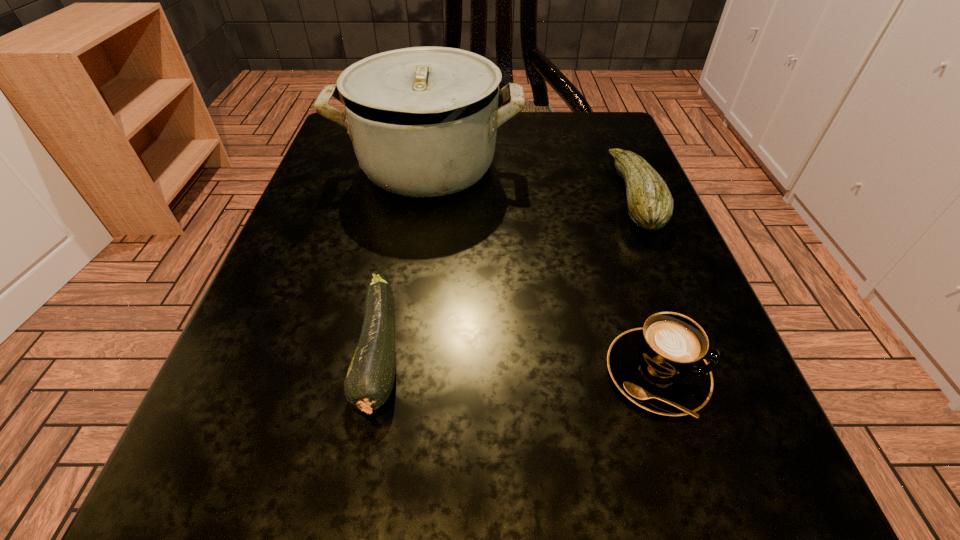
This screenshot has height=540, width=960. Find the location of `free spot between the cappuccino and the right zucchini`. free spot between the cappuccino and the right zucchini is located at coordinates (645, 284).

Identify the location of vacant area that lies between the left zucchini and the right zucchini. (507, 275).

The image size is (960, 540). Identify the location of free space that is in between the cappuccino and the tallest object. (542, 271).

Locate which object is the closest to the shorter zucchini. Please provide its 2D coordinates. Your answer should be formatted as a tuple, i.e. [(x, y)], where the tuple contains the x and y coordinates of a point satisfying the conditions above.

[(423, 121)]

Locate an element on the screen. Image resolution: width=960 pixels, height=540 pixels. the third closest object to the saucepan is located at coordinates (661, 367).

The image size is (960, 540). Find the location of `free spot that satisfies the following two spatial constraints: 1. at the stem end of the taller zucchini; 2. at the blossom end of the left zucchini`. free spot that satisfies the following two spatial constraints: 1. at the stem end of the taller zucchini; 2. at the blossom end of the left zucchini is located at coordinates (700, 355).

At what (x,y) coordinates should I click in order to perform the action: click on vacant area that satisfies the following two spatial constraints: 1. at the stem end of the right zucchini; 2. at the blossom end of the left zucchini. Please return your answer as a coordinate pair (x, y). Looking at the image, I should click on (700, 355).

I want to click on free space that satisfies the following two spatial constraints: 1. at the stem end of the taller zucchini; 2. at the blossom end of the left zucchini, so click(x=700, y=355).

Find the location of `vacant point that satisfies the following two spatial constraints: 1. at the stem end of the farther zucchini; 2. at the blossom end of the shorter zucchini`. vacant point that satisfies the following two spatial constraints: 1. at the stem end of the farther zucchini; 2. at the blossom end of the shorter zucchini is located at coordinates (700, 355).

What are the coordinates of `blank space that satisfies the following two spatial constraints: 1. at the blossom end of the shortest object; 2. on the left side of the cappuccino` in the screenshot? It's located at (376, 374).